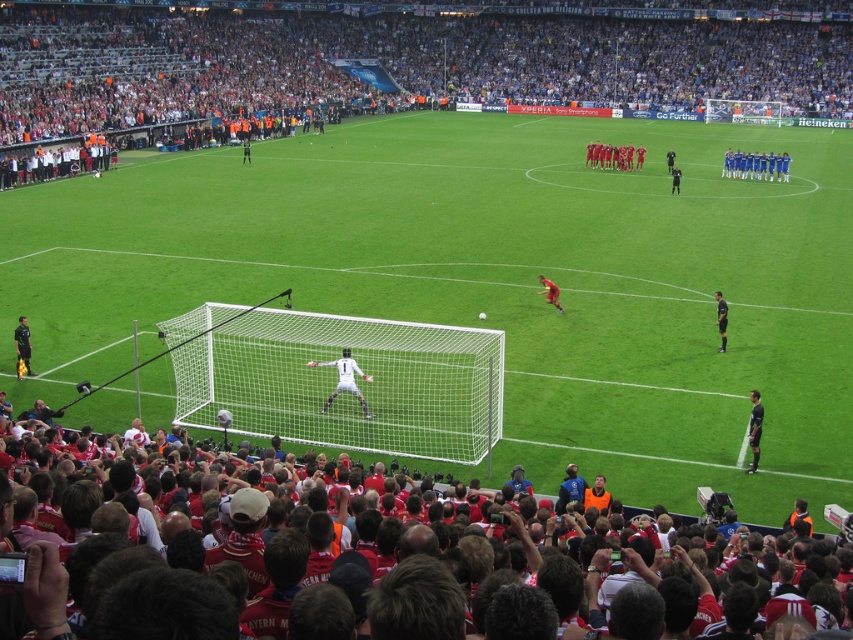
You are a referee observing the soccer match. You notice two individuals at the center of the field, a blue jersey at center and a black uniformed person at center. Which one is taller?

The blue jersey at center is taller than the black uniformed person at center.

You are a referee watching the soccer match. You notice a point marked at coordinates (756, 164). What is the color of the jersey at that point?

The point (756, 164) indicates a blue jersey at center, so the jersey color is blue.